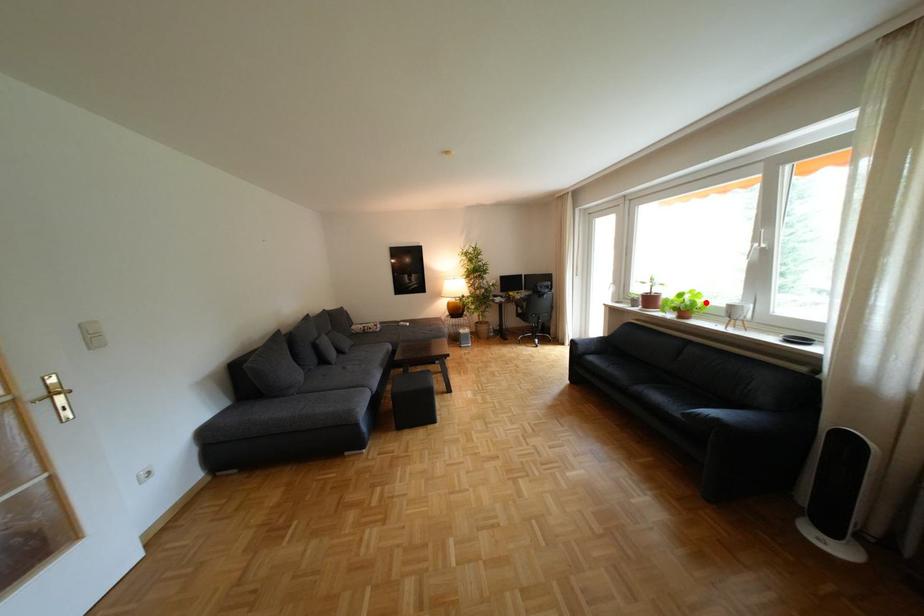
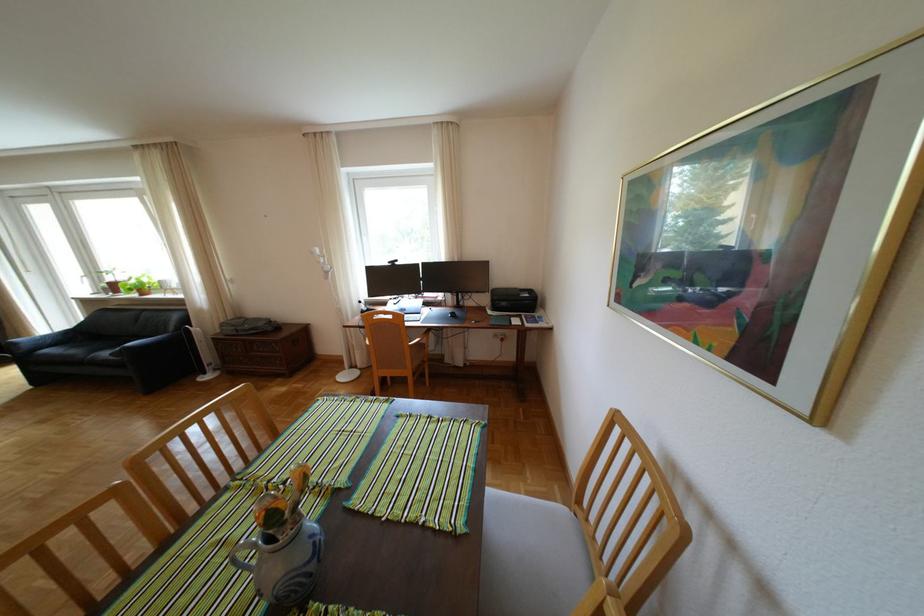
In the second image, find the point that corresponds to the highlighted location in the first image.

(154, 283)